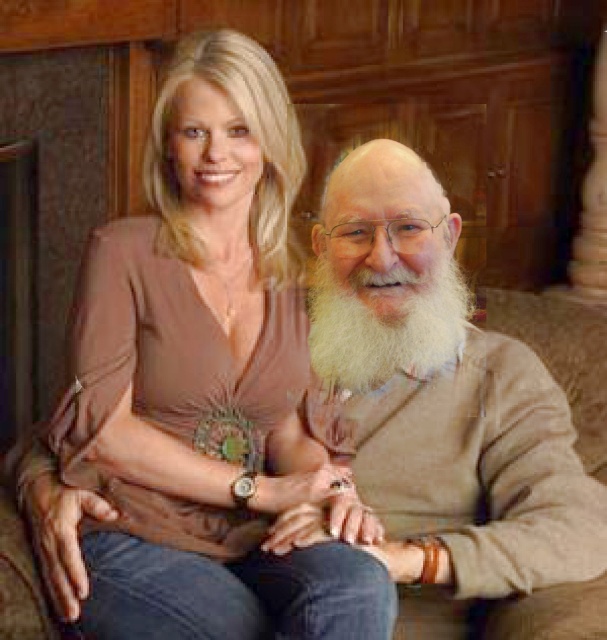
You are a photographer adjusting your camera settings to capture the scene. You notice the matte brown blouse at center and the white fluffy beard at center. Which object is located to the left of the other?

The matte brown blouse at center is positioned on the left side of white fluffy beard at center.

You are a photographer setting up for a family portrait. You need to place a small decorative vase between the white beard at center and the brown fabric couch at center. According to the scene description, where should you place the vase?

The white beard at center is positioned on the left side of brown fabric couch at center, so the vase should be placed between them on the left side of the brown fabric couch at center.